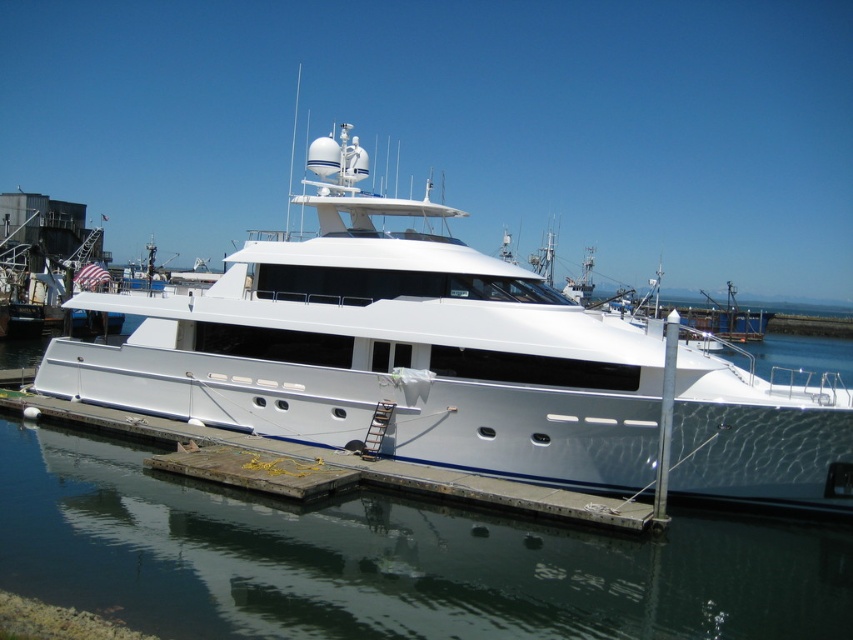
Can you confirm if white glossy yacht at center is positioned below concrete at center?

Actually, white glossy yacht at center is above concrete at center.

Between point (263, 266) and point (325, 480), which one is positioned behind?

Point (263, 266)

Locate an element on the screen. white glossy yacht at center is located at coordinates (450, 364).

What do you see at coordinates (390, 561) in the screenshot? I see `glossy metallic water at center` at bounding box center [390, 561].

You are a GUI agent. You are given a task and a screenshot of the screen. Output one action in this format:
    pyautogui.click(x=<x>, y=<y>)
    Task: Click on the glossy metallic water at center
    
    Given the screenshot: What is the action you would take?
    pyautogui.click(x=390, y=561)

Where is `glossy metallic water at center`? The image size is (853, 640). glossy metallic water at center is located at coordinates (390, 561).

Does white glossy yacht at center appear on the left side of glossy metallic water at center?

Incorrect, white glossy yacht at center is not on the left side of glossy metallic water at center.

Between white glossy yacht at center and glossy metallic water at center, which one appears on the left side from the viewer's perspective?

glossy metallic water at center is more to the left.

What do you see at coordinates (450, 364) in the screenshot? The width and height of the screenshot is (853, 640). I see `white glossy yacht at center` at bounding box center [450, 364].

Where is `white glossy yacht at center`? The height and width of the screenshot is (640, 853). white glossy yacht at center is located at coordinates (450, 364).